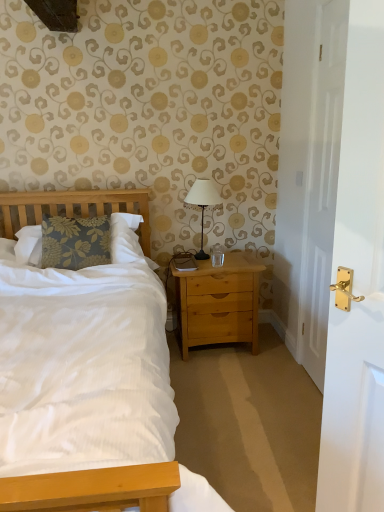
Question: Is white glossy door at right to the left of matte black lamp at center from the viewer's perspective?

Choices:
 (A) yes
 (B) no

Answer: (B)

Question: Is white glossy door at right to the right of matte black lamp at center from the viewer's perspective?

Choices:
 (A) yes
 (B) no

Answer: (A)

Question: Is white glossy door at right next to matte black lamp at center and touching it?

Choices:
 (A) yes
 (B) no

Answer: (B)

Question: Could you tell me if white glossy door at right is facing matte black lamp at center?

Choices:
 (A) no
 (B) yes

Answer: (A)

Question: Is white glossy door at right not inside matte black lamp at center?

Choices:
 (A) yes
 (B) no

Answer: (A)

Question: Is white glossy door at right looking in the opposite direction of matte black lamp at center?

Choices:
 (A) yes
 (B) no

Answer: (B)

Question: Does matte black lamp at center appear on the left side of light brown wood nightstand at right?

Choices:
 (A) no
 (B) yes

Answer: (B)

Question: Can you confirm if matte black lamp at center is positioned to the right of light brown wood nightstand at right?

Choices:
 (A) yes
 (B) no

Answer: (B)

Question: Does matte black lamp at center have a smaller size compared to light brown wood nightstand at right?

Choices:
 (A) yes
 (B) no

Answer: (A)

Question: From the image's perspective, is matte black lamp at center on light brown wood nightstand at right?

Choices:
 (A) no
 (B) yes

Answer: (B)

Question: Is matte black lamp at center in front of light brown wood nightstand at right?

Choices:
 (A) no
 (B) yes

Answer: (A)

Question: Is light brown wood nightstand at right surrounded by matte black lamp at center?

Choices:
 (A) yes
 (B) no

Answer: (B)

Question: Is white glossy door at right facing towards light brown wood nightstand at right?

Choices:
 (A) no
 (B) yes

Answer: (A)